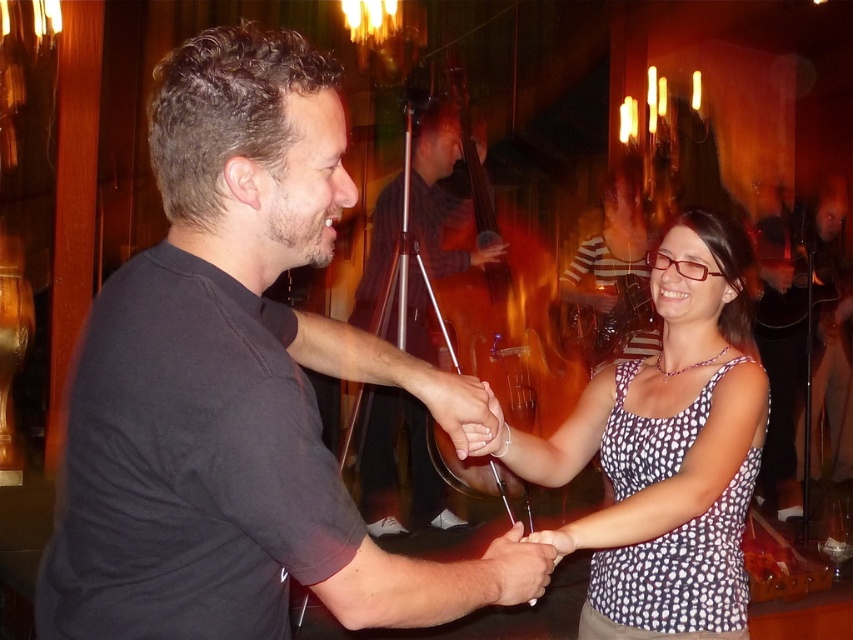
Question: Does black matte shirt at center appear under black matte hand at center?

Choices:
 (A) no
 (B) yes

Answer: (B)

Question: Observing the image, what is the correct spatial positioning of black matte shirt at center in reference to matte black hand at center?

Choices:
 (A) left
 (B) right

Answer: (A)

Question: Among these objects, which one is farthest from the camera?

Choices:
 (A) matte black hand at center
 (B) black matte hand at center
 (C) smooth skin at center
 (D) white dotted tank top at center

Answer: (A)

Question: Which of the following is the farthest from the observer?

Choices:
 (A) smooth skin at center
 (B) white dotted tank top at center
 (C) black matte shirt at center

Answer: (A)

Question: Does black matte shirt at center appear under smooth white pen at center?

Choices:
 (A) yes
 (B) no

Answer: (B)

Question: Which of these objects is positioned farthest from the matte black hand at center?

Choices:
 (A) smooth white pen at center
 (B) black matte shirt at center
 (C) white dotted tank top at center

Answer: (B)